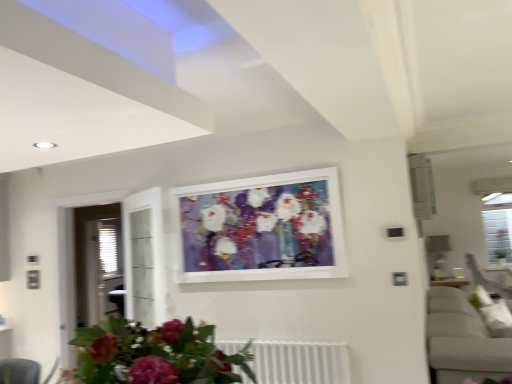
Question: Is matte white picture frame at center positioned far away from matte pink flowers at lower center?

Choices:
 (A) no
 (B) yes

Answer: (B)

Question: Is matte white picture frame at center oriented away from matte pink flowers at lower center?

Choices:
 (A) no
 (B) yes

Answer: (A)

Question: Considering the relative sizes of matte white picture frame at center and matte pink flowers at lower center in the image provided, is matte white picture frame at center wider than matte pink flowers at lower center?

Choices:
 (A) yes
 (B) no

Answer: (B)

Question: From a real-world perspective, does matte white picture frame at center stand above matte pink flowers at lower center?

Choices:
 (A) yes
 (B) no

Answer: (A)

Question: Is matte pink flowers at lower center located within matte white picture frame at center?

Choices:
 (A) no
 (B) yes

Answer: (A)

Question: Does matte white picture frame at center have a greater height compared to matte pink flowers at lower center?

Choices:
 (A) no
 (B) yes

Answer: (B)

Question: Is matte white picture frame at center in contact with white metallic radiator at lower center?

Choices:
 (A) yes
 (B) no

Answer: (B)

Question: From the image's perspective, would you say matte white picture frame at center is positioned over white metallic radiator at lower center?

Choices:
 (A) no
 (B) yes

Answer: (B)

Question: Would you say matte white picture frame at center is a long distance from white metallic radiator at lower center?

Choices:
 (A) yes
 (B) no

Answer: (B)

Question: Is white metallic radiator at lower center located within matte white picture frame at center?

Choices:
 (A) no
 (B) yes

Answer: (A)

Question: From a real-world perspective, is matte white picture frame at center located beneath white metallic radiator at lower center?

Choices:
 (A) yes
 (B) no

Answer: (B)

Question: Does matte white picture frame at center appear on the left side of white metallic radiator at lower center?

Choices:
 (A) no
 (B) yes

Answer: (B)

Question: Is white metallic radiator at lower center to the right of matte white picture frame at center from the viewer's perspective?

Choices:
 (A) no
 (B) yes

Answer: (B)